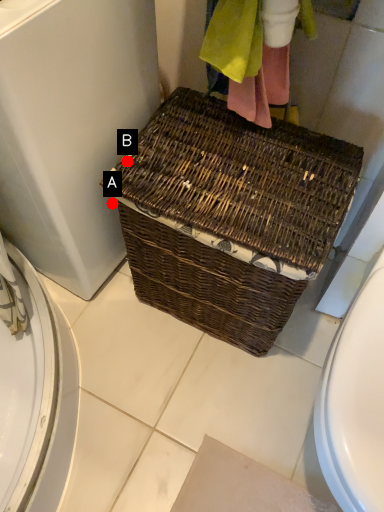
Question: Two points are circled on the image, labeled by A and B beside each circle. Among these points, which one is farthest from the camera?

Choices:
 (A) A is further
 (B) B is further

Answer: (A)